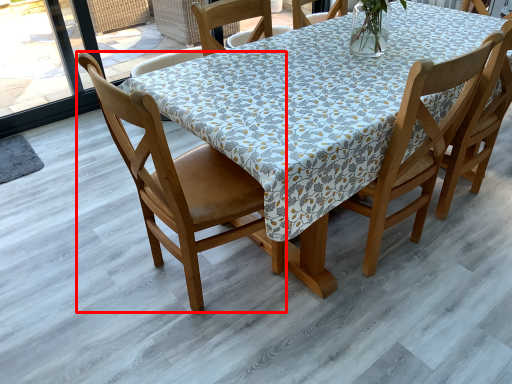
Question: From the image's perspective, where is chair (annotated by the red box) located in relation to chair in the image?

Choices:
 (A) above
 (B) below

Answer: (B)